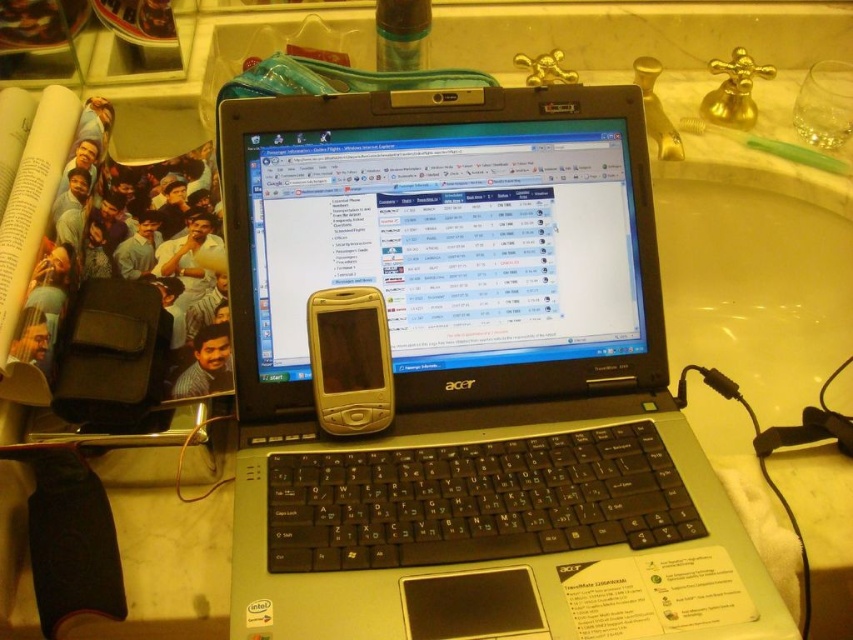
You have a small desk and need to place both the black plastic laptop at center and the gold plastic phone at center side by side. Given their sizes, which one should you place on the left to ensure they both fit without overlapping?

Since the black plastic laptop at center is wider than the gold plastic phone at center, you should place the narrower gold plastic phone at center on the left to minimize the total width required.

You are a delivery robot that needs to deliver a package to the black plastic laptop at center. The delivery zone is a circle with a radius of 0.1 units centered at point 0.6, 0.55. Will you be able to place the package within the delivery zone?

The 2D location of the black plastic laptop at center is at point (469, 380). The distance between the laptop and the delivery zone center is sqrt of squared difference between 0.594 and 0.6 in x plus squared difference between 0.551 and 0.55 in y. Calculating that gives sqrt of 0.000036 plus 0.000001, which is sqrt of 0.000037, approximately 0.00608 units. Since this distance is less than the radius of 0.1 units, the package can be placed within the delivery zone.

You are organizing your desk and want to place both the black plastic laptop at center and the gold plastic phone at center so that neither is blocking the other. Which object should you move to ensure this?

The black plastic laptop at center is positioned over the gold plastic phone at center. To prevent blocking, move the black plastic laptop at center to a different location so the gold plastic phone at center is visible.